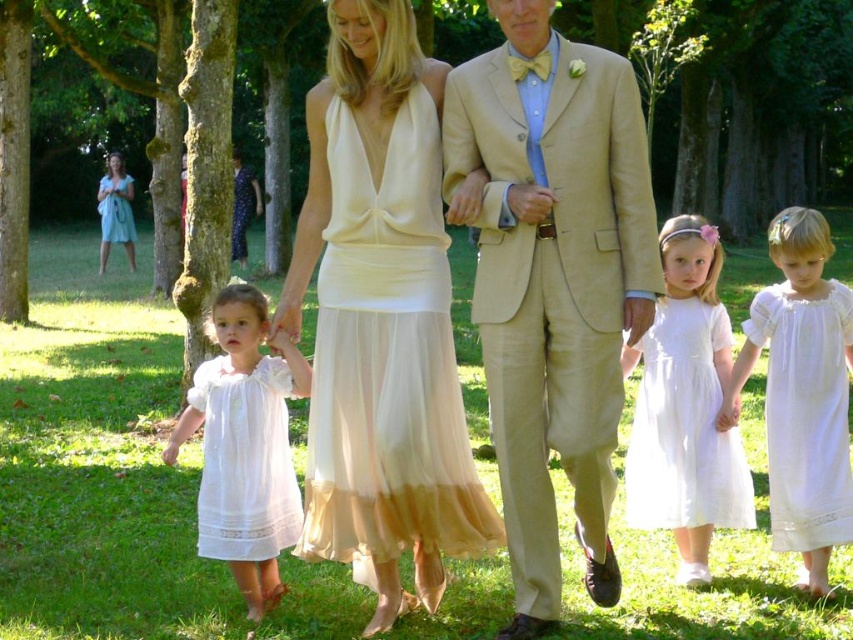
You are a photographer trying to capture a closeup of the white lace dress at center without the matte blue dress at upper left appearing in the background. Is this possible based on their positions?

Yes, since the white lace dress at center is in front of the matte blue dress at upper left, you can focus on the white lace dress at center and exclude the matte blue dress at upper left from the frame by adjusting the camera angle or zoom.